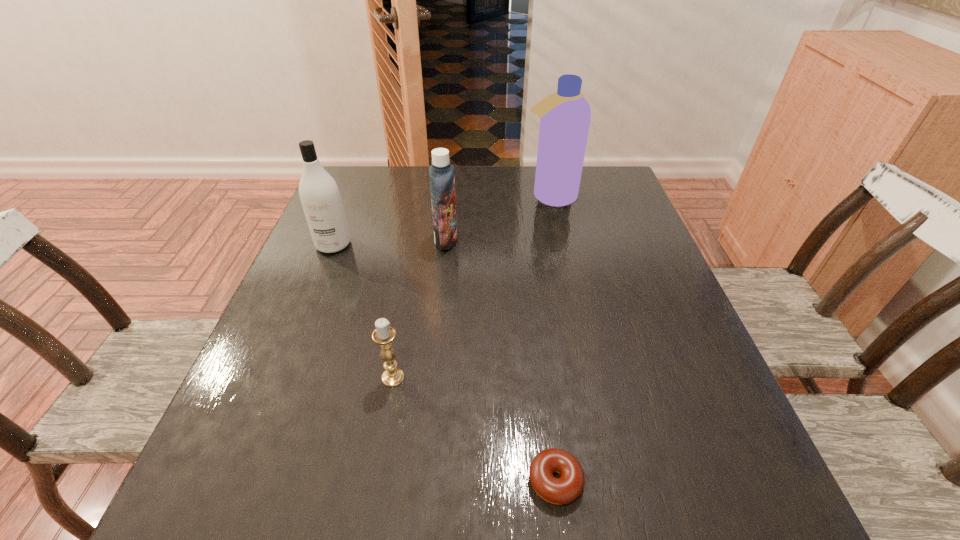
This screenshot has height=540, width=960. Identify the location of vacant space located 0.190m on the front label of the second shampoo from right to left. (533, 240).

Identify the location of vacant space located on the left of the second object from left to right. (261, 377).

Where is `vacant area located on the right of the doughnut`? vacant area located on the right of the doughnut is located at coordinates (668, 481).

Where is `object present at the far edge`? object present at the far edge is located at coordinates (565, 116).

The image size is (960, 540). Find the location of `object present at the near edge`. object present at the near edge is located at coordinates (563, 490).

Find the location of a particular element. Image resolution: width=960 pixels, height=540 pixels. object at the left edge is located at coordinates (319, 194).

This screenshot has height=540, width=960. Find the location of `object at the right edge`. object at the right edge is located at coordinates (565, 116).

Image resolution: width=960 pixels, height=540 pixels. What are the coordinates of `object at the far right corner` in the screenshot? It's located at (565, 116).

At what (x,y) coordinates should I click in order to perform the action: click on free spot at the far edge of the desktop. Please return your answer as a coordinate pair (x, y). Image resolution: width=960 pixels, height=540 pixels. Looking at the image, I should click on (408, 202).

Where is `free space at the near edge of the desktop`? Image resolution: width=960 pixels, height=540 pixels. free space at the near edge of the desktop is located at coordinates (348, 502).